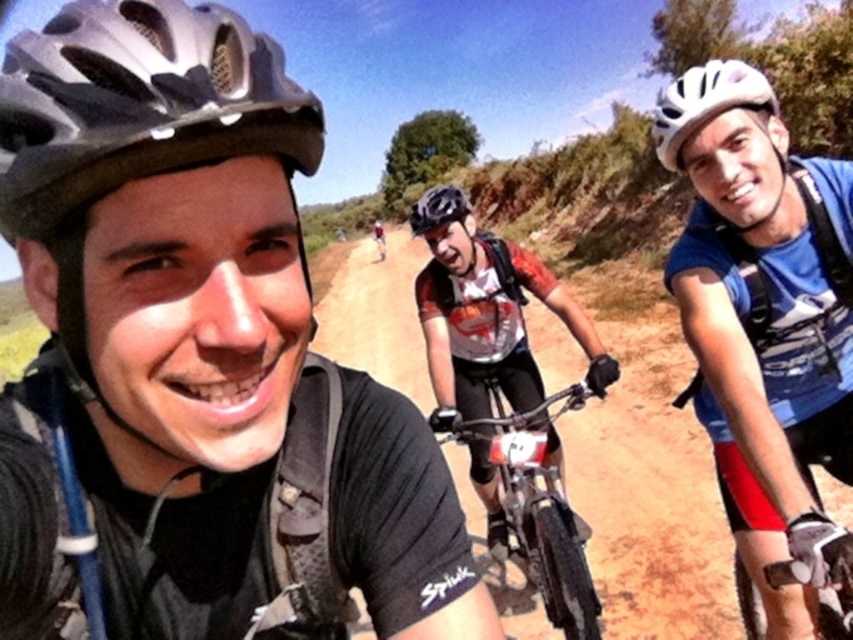
Question: Can you confirm if metallic silver helmet at upper left is positioned below shiny metallic bike at center?

Choices:
 (A) no
 (B) yes

Answer: (A)

Question: Which object is the closest to the white matte bicycle helmet at upper right?

Choices:
 (A) shiny metallic bike at center
 (B) metallic silver helmet at upper left
 (C) matte black helmet at center

Answer: (A)

Question: Which of the following is the closest to the observer?

Choices:
 (A) shiny metallic bike at center
 (B) metallic silver helmet at upper left
 (C) white matte bicycle helmet at upper right

Answer: (B)

Question: Can you confirm if shiny metallic bike at center is positioned below white matte bicycle helmet at upper right?

Choices:
 (A) yes
 (B) no

Answer: (A)

Question: Which point is closer to the camera?

Choices:
 (A) (434, 212)
 (B) (161, 33)
 (C) (738, 86)

Answer: (B)

Question: Considering the relative positions of shiny metallic bike at center and white matte bicycle helmet at upper right in the image provided, where is shiny metallic bike at center located with respect to white matte bicycle helmet at upper right?

Choices:
 (A) right
 (B) left

Answer: (B)